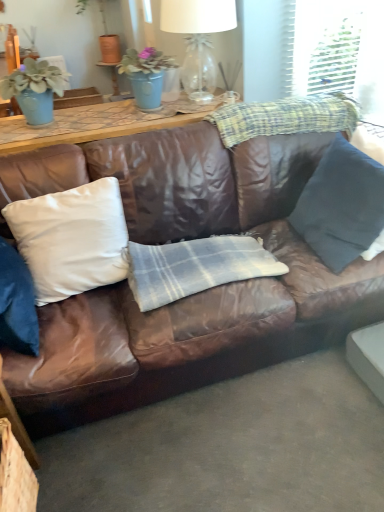
Describe the element at coordinates (35, 89) in the screenshot. I see `matte blue vase at upper left, which is the second houseplant from right to left` at that location.

The height and width of the screenshot is (512, 384). In order to click on plaid fabric at center, acting as the 2th plaid starting from the top in this screenshot , I will do `click(195, 267)`.

Which plaid is the 1st one when counting from the right side of the white satin pillow at center, which is the 2th pillow from right to left? Please provide its 2D coordinates.

[(195, 267)]

From the picture: Does white satin pillow at center, the first pillow in the left-to-right sequence, have a greater width compared to plaid fabric at center, acting as the 2th plaid starting from the top?

No.

Is white satin pillow at center, the first pillow in the left-to-right sequence, bigger than plaid fabric at center, which is the 1th plaid from bottom to top?

Correct, white satin pillow at center, the first pillow in the left-to-right sequence, is larger in size than plaid fabric at center, which is the 1th plaid from bottom to top.

Considering the relative sizes of dark blue fabric pillow at right, placed as the 1th pillow when sorted from right to left, and plaid fabric at upper right, the second plaid in the bottom-to-top sequence, in the image provided, is dark blue fabric pillow at right, placed as the 1th pillow when sorted from right to left, smaller than plaid fabric at upper right, the second plaid in the bottom-to-top sequence,?

Indeed, dark blue fabric pillow at right, placed as the 1th pillow when sorted from right to left, has a smaller size compared to plaid fabric at upper right, the second plaid in the bottom-to-top sequence.

Is dark blue fabric pillow at right, the second pillow when ordered from left to right, wider or thinner than plaid fabric at upper right, which ranks as the 1th plaid in top-to-bottom order?

Clearly, dark blue fabric pillow at right, the second pillow when ordered from left to right, has less width compared to plaid fabric at upper right, which ranks as the 1th plaid in top-to-bottom order.

Which is more to the right, matte blue pot at upper center, the second houseplant from the left, or white satin pillow at center, the first pillow in the left-to-right sequence?

Positioned to the right is matte blue pot at upper center, the second houseplant from the left.

Is matte blue pot at upper center, the second houseplant from the left, not within white satin pillow at center, the first pillow in the left-to-right sequence?

matte blue pot at upper center, the second houseplant from the left, lies outside white satin pillow at center, the first pillow in the left-to-right sequence,'s area.

Is matte blue pot at upper center, the second houseplant from the left, aimed at white satin pillow at center, which is the 2th pillow from right to left?

No, matte blue pot at upper center, the second houseplant from the left, is not turned towards white satin pillow at center, which is the 2th pillow from right to left.

In terms of height, does matte blue pot at upper center, arranged as the first houseplant when viewed from the right, look taller or shorter compared to white satin pillow at center, which is the 2th pillow from right to left?

Clearly, matte blue pot at upper center, arranged as the first houseplant when viewed from the right, is shorter compared to white satin pillow at center, which is the 2th pillow from right to left.

Based on the photo, from the image's perspective, which is above, matte blue vase at upper left, which appears as the 1th houseplant when viewed from the left, or dark blue fabric pillow at right, the second pillow when ordered from left to right?

matte blue vase at upper left, which appears as the 1th houseplant when viewed from the left, is shown above in the image.

Is matte blue vase at upper left, which is the second houseplant from right to left, bigger than dark blue fabric pillow at right, placed as the 1th pillow when sorted from right to left?

Answer: No.

How far apart are matte blue vase at upper left, which appears as the 1th houseplant when viewed from the left, and dark blue fabric pillow at right, the second pillow when ordered from left to right?

matte blue vase at upper left, which appears as the 1th houseplant when viewed from the left, is 1.40 meters from dark blue fabric pillow at right, the second pillow when ordered from left to right.

Considering the sizes of objects matte blue vase at upper left, which appears as the 1th houseplant when viewed from the left, and dark blue fabric pillow at right, the second pillow when ordered from left to right, in the image provided, who is taller, matte blue vase at upper left, which appears as the 1th houseplant when viewed from the left, or dark blue fabric pillow at right, the second pillow when ordered from left to right,?

Standing taller between the two is dark blue fabric pillow at right, the second pillow when ordered from left to right.

Between plaid fabric at center, acting as the 2th plaid starting from the top, and matte blue pot at upper center, arranged as the first houseplant when viewed from the right, which one has more height?

Standing taller between the two is matte blue pot at upper center, arranged as the first houseplant when viewed from the right.

Can you confirm if plaid fabric at center, which is the 1th plaid from bottom to top, is positioned to the right of matte blue pot at upper center, the second houseplant from the left?

Correct, you'll find plaid fabric at center, which is the 1th plaid from bottom to top, to the right of matte blue pot at upper center, the second houseplant from the left.

Locate an element on the screen. The height and width of the screenshot is (512, 384). plaid that is the 2nd one when counting downward from the matte blue pot at upper center, arranged as the first houseplant when viewed from the right (from the image's perspective) is located at coordinates pyautogui.click(x=195, y=267).

Can you confirm if plaid fabric at center, which is the 1th plaid from bottom to top, is wider than matte blue vase at upper left, which appears as the 1th houseplant when viewed from the left?

Correct, the width of plaid fabric at center, which is the 1th plaid from bottom to top, exceeds that of matte blue vase at upper left, which appears as the 1th houseplant when viewed from the left.

Does plaid fabric at center, acting as the 2th plaid starting from the top, turn towards matte blue vase at upper left, which is the second houseplant from right to left?

No, plaid fabric at center, acting as the 2th plaid starting from the top, is not oriented towards matte blue vase at upper left, which is the second houseplant from right to left.

Which object is positioned more to the right, plaid fabric at center, acting as the 2th plaid starting from the top, or matte blue vase at upper left, which appears as the 1th houseplant when viewed from the left?

Positioned to the right is plaid fabric at center, acting as the 2th plaid starting from the top.

Can you confirm if brown leather couch at center is taller than plaid fabric at center, acting as the 2th plaid starting from the top?

Yes.

Locate an element on the screen. The height and width of the screenshot is (512, 384). plaid that appears below the brown leather couch at center (from the image's perspective) is located at coordinates (195, 267).

From the image's perspective, between brown leather couch at center and plaid fabric at center, which is the 1th plaid from bottom to top, who is located below?

plaid fabric at center, which is the 1th plaid from bottom to top.

Could you tell me if brown leather couch at center is turned towards plaid fabric at center, acting as the 2th plaid starting from the top?

Yes, brown leather couch at center is facing plaid fabric at center, acting as the 2th plaid starting from the top.

Which pillow is the 2nd one when counting from the front of the plaid fabric at center, acting as the 2th plaid starting from the top? Please provide its 2D coordinates.

[(72, 239)]

Where is `plaid that is the 2nd object located behind the dark blue fabric pillow at right, the second pillow when ordered from left to right`? This screenshot has width=384, height=512. plaid that is the 2nd object located behind the dark blue fabric pillow at right, the second pillow when ordered from left to right is located at coordinates (285, 117).

When comparing their distances from white satin pillow at center, the first pillow in the left-to-right sequence, does plaid fabric at upper right, the second plaid in the bottom-to-top sequence, or matte blue pot at upper center, the second houseplant from the left, seem closer?

plaid fabric at upper right, the second plaid in the bottom-to-top sequence, lies closer to white satin pillow at center, the first pillow in the left-to-right sequence, than the other object.

Looking at the image, which one is located closer to white satin pillow at center, the first pillow in the left-to-right sequence, matte blue vase at upper left, which is the second houseplant from right to left, or brown leather couch at center?

The object closer to white satin pillow at center, the first pillow in the left-to-right sequence, is brown leather couch at center.

Based on their spatial positions, is brown leather couch at center or white satin pillow at center, which is the 2th pillow from right to left, closer to matte blue pot at upper center, arranged as the first houseplant when viewed from the right?

Among the two, white satin pillow at center, which is the 2th pillow from right to left, is located nearer to matte blue pot at upper center, arranged as the first houseplant when viewed from the right.

Based on their spatial positions, is plaid fabric at center, which is the 1th plaid from bottom to top, or clear glass lampshade at upper center further from white satin pillow at center, which is the 2th pillow from right to left?

clear glass lampshade at upper center is positioned further to the anchor white satin pillow at center, which is the 2th pillow from right to left.

Considering their positions, is white satin pillow at center, the first pillow in the left-to-right sequence, positioned further to matte blue vase at upper left, which appears as the 1th houseplant when viewed from the left, than clear glass lampshade at upper center?

The object further to matte blue vase at upper left, which appears as the 1th houseplant when viewed from the left, is clear glass lampshade at upper center.

When comparing their distances from matte blue vase at upper left, which is the second houseplant from right to left, does white satin pillow at center, which is the 2th pillow from right to left, or brown leather couch at center seem closer?

white satin pillow at center, which is the 2th pillow from right to left.

From the image, which object appears to be farther from white satin pillow at center, the first pillow in the left-to-right sequence, dark blue fabric pillow at right, the second pillow when ordered from left to right, or clear glass lampshade at upper center?

clear glass lampshade at upper center.

Looking at the image, which one is located closer to plaid fabric at center, acting as the 2th plaid starting from the top, brown leather couch at center or dark blue fabric pillow at right, placed as the 1th pillow when sorted from right to left?

Based on the image, brown leather couch at center appears to be nearer to plaid fabric at center, acting as the 2th plaid starting from the top.

Identify the location of houseplant between white satin pillow at center, the first pillow in the left-to-right sequence, and plaid fabric at upper right, the second plaid in the bottom-to-top sequence, from left to right. Image resolution: width=384 pixels, height=512 pixels. (146, 75).

The image size is (384, 512). I want to click on plaid between clear glass lampshade at upper center and plaid fabric at center, acting as the 2th plaid starting from the top, vertically, so click(x=285, y=117).

This screenshot has width=384, height=512. Identify the location of table lamp situated between matte blue vase at upper left, which is the second houseplant from right to left, and dark blue fabric pillow at right, placed as the 1th pillow when sorted from right to left, from left to right. (198, 39).

Find the location of a particular element. The width and height of the screenshot is (384, 512). houseplant between matte blue vase at upper left, which appears as the 1th houseplant when viewed from the left, and plaid fabric at upper right, which ranks as the 1th plaid in top-to-bottom order, from left to right is located at coordinates [146, 75].